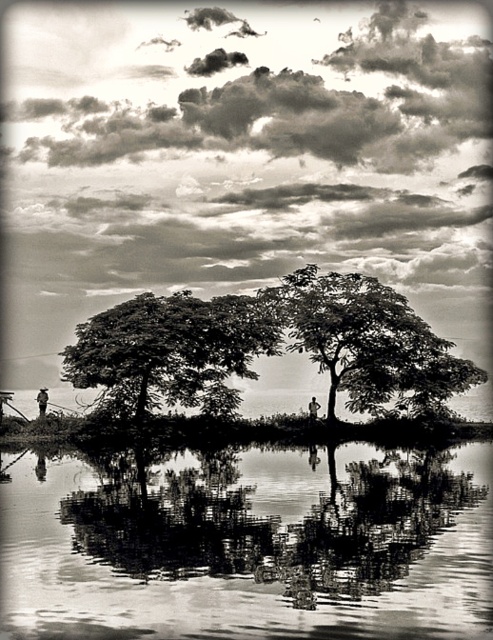
Can you confirm if smooth reflective water at center is positioned to the right of smooth bark tree at center?

In fact, smooth reflective water at center is to the left of smooth bark tree at center.

Consider the image. Measure the distance from smooth reflective water at center to smooth bark tree at center.

A distance of 8.19 meters exists between smooth reflective water at center and smooth bark tree at center.

The height and width of the screenshot is (640, 493). Describe the element at coordinates (272, 516) in the screenshot. I see `smooth reflective water at center` at that location.

Find the location of a particular element. This screenshot has height=640, width=493. smooth reflective water at center is located at coordinates (272, 516).

Is dark green leafy tree at center taller than smooth bark tree at center?

No, dark green leafy tree at center is not taller than smooth bark tree at center.

Between dark green leafy tree at center and smooth bark tree at center, which one is positioned higher?

smooth bark tree at center is higher up.

Image resolution: width=493 pixels, height=640 pixels. What do you see at coordinates (173, 349) in the screenshot? I see `dark green leafy tree at center` at bounding box center [173, 349].

Locate an element on the screen. This screenshot has height=640, width=493. dark green leafy tree at center is located at coordinates (173, 349).

Is point (246, 577) positioned after point (81, 330)?

No.

Between smooth reflective water at center and dark green leafy tree at center, which one has more height?

dark green leafy tree at center

What do you see at coordinates (272, 516) in the screenshot?
I see `smooth reflective water at center` at bounding box center [272, 516].

Image resolution: width=493 pixels, height=640 pixels. I want to click on smooth reflective water at center, so click(x=272, y=516).